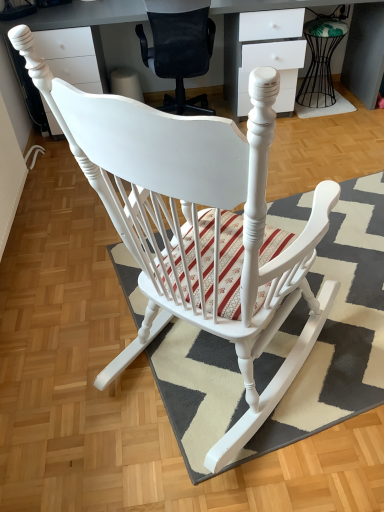
Find the location of a particular element. This screenshot has height=512, width=384. free space in front of metallic wire stool at upper right is located at coordinates (329, 110).